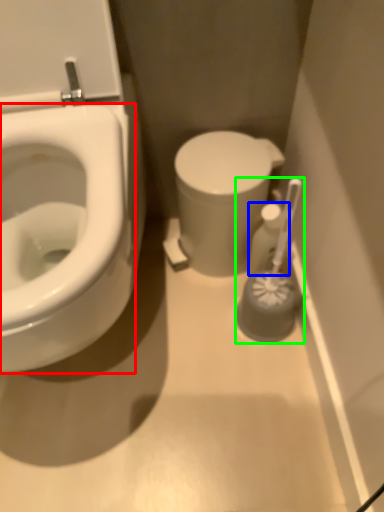
Question: Which is nearer to the bidet (highlighted by a red box)? toiletry (highlighted by a blue box) or brush (highlighted by a green box).

Choices:
 (A) toiletry
 (B) brush

Answer: (B)